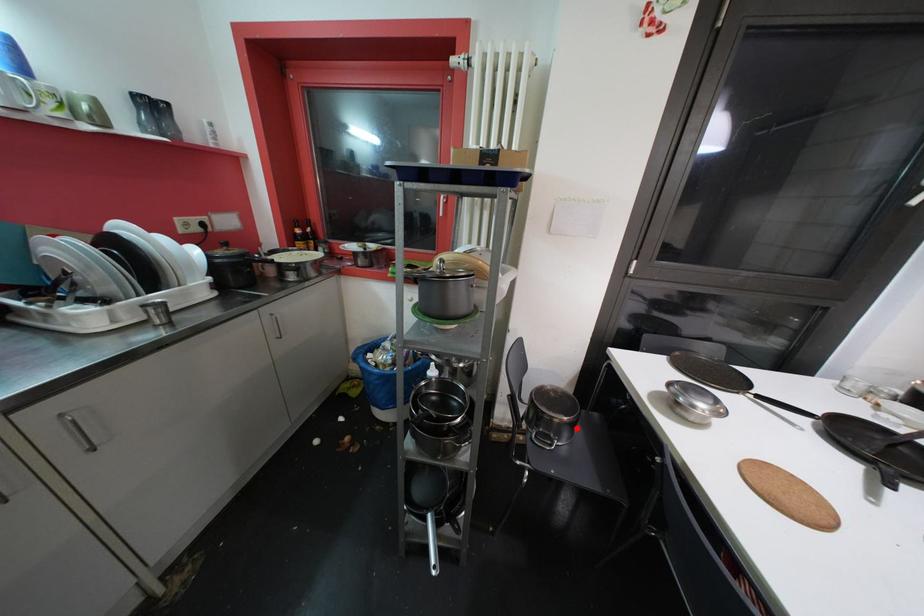
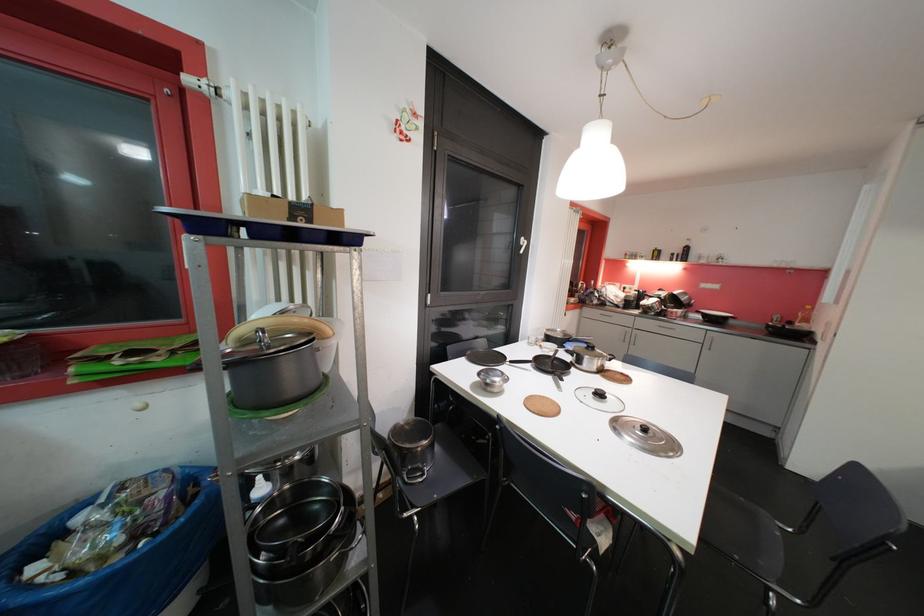
Question: I am providing you with two images of the same scene from different viewpoints. A red point is marked on the first image. Is the red point's position out of view in image 2?

Choices:
 (A) Yes
 (B) No

Answer: (B)